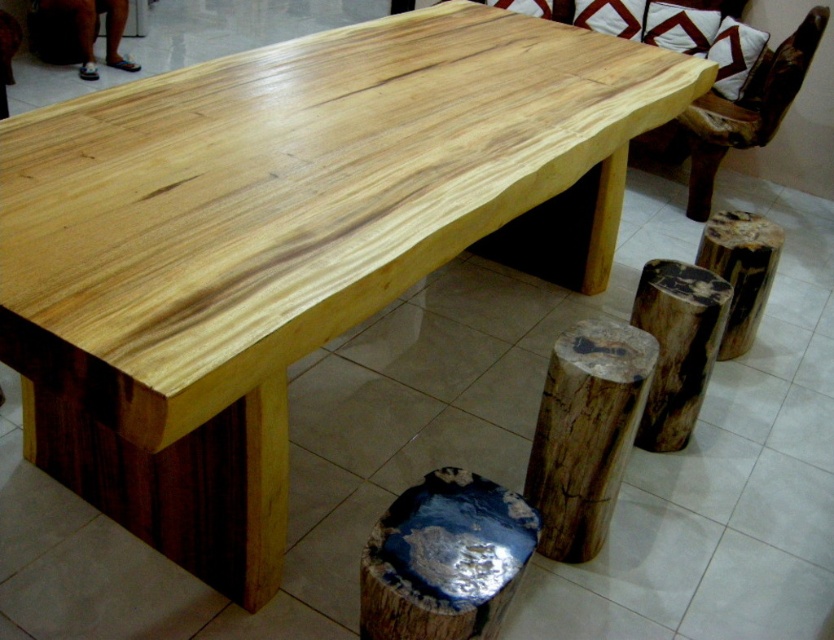
Question: Among these objects, which one is nearest to the camera?

Choices:
 (A) natural wood log at lower center
 (B) blue polished wood stool at lower center
 (C) dark brown wood log at lower right

Answer: (B)

Question: Can you confirm if natural wood log at lower right is smaller than natural wood chair at upper right?

Choices:
 (A) no
 (B) yes

Answer: (B)

Question: Which point is closer to the camera taking this photo?

Choices:
 (A) (671, 349)
 (B) (719, 152)
 (C) (500, 621)
 (D) (604, 524)

Answer: (C)

Question: Is blue polished wood stool at lower center below natural wood chair at upper right?

Choices:
 (A) no
 (B) yes

Answer: (B)

Question: Which point is farther from the camera taking this photo?

Choices:
 (A) (584, 476)
 (B) (684, 308)
 (C) (757, 136)
 (D) (431, 540)

Answer: (C)

Question: Considering the relative positions of natural wood log at lower center and dark brown wood log at lower right in the image provided, where is natural wood log at lower center located with respect to dark brown wood log at lower right?

Choices:
 (A) below
 (B) above

Answer: (A)